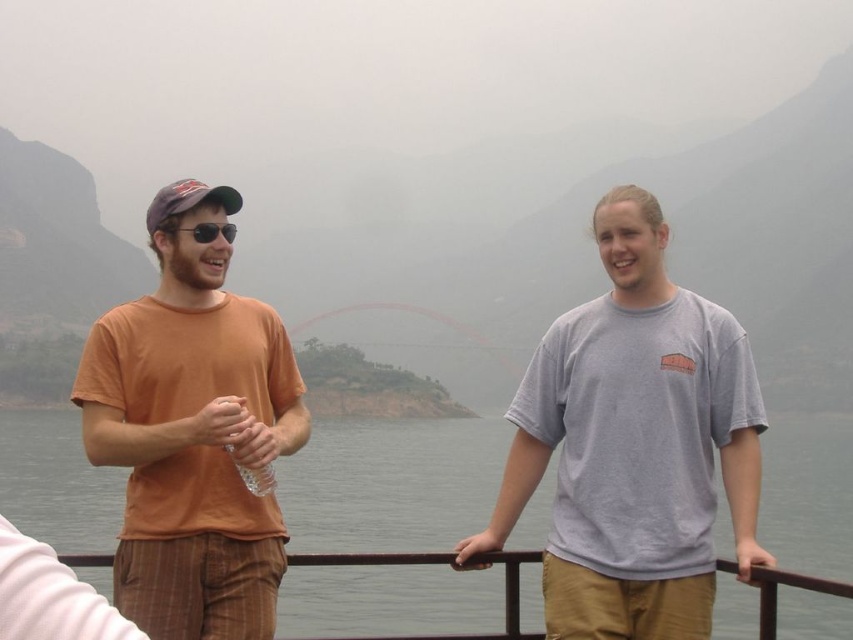
You are a photographer trying to capture the orange cotton t at left and the red bridge in the background. Since the orange cotton t is at point (193, 433), where should you position your camera to ensure both are in frame?

The orange cotton t at left is located at point (193, 433). To include both the orange cotton t at left and the red bridge in the background, position the camera so that the orange cotton t at left is centered at (193, 433) and the red bridge is framed in the background.